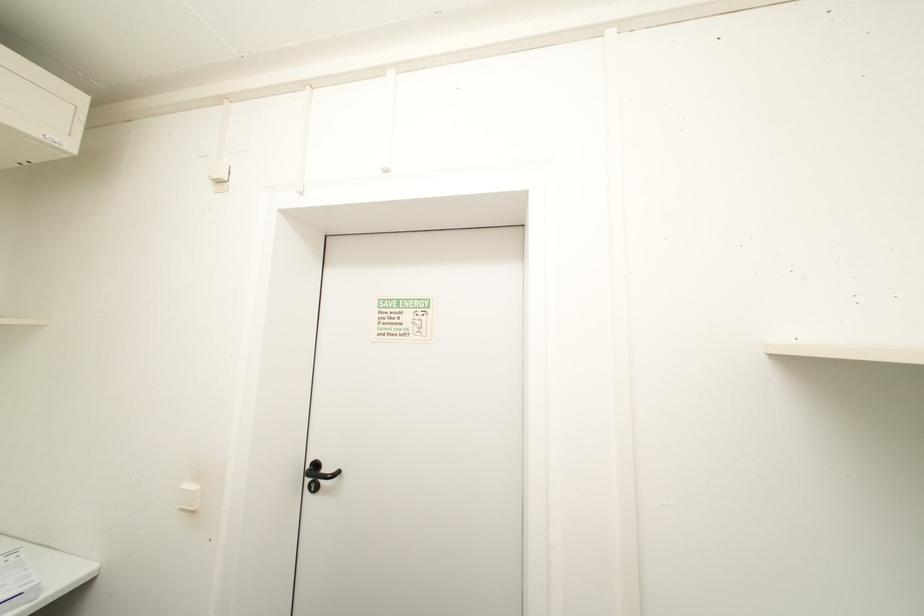
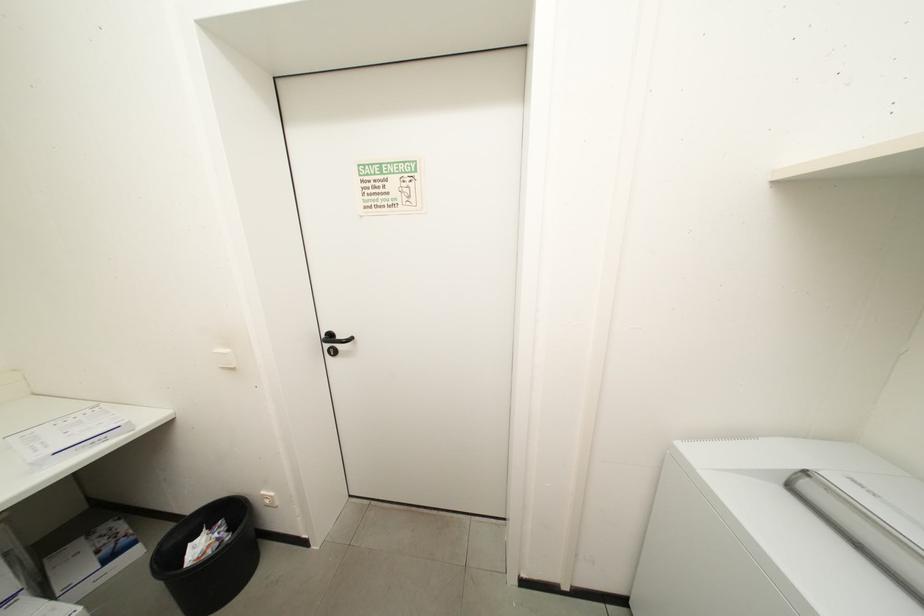
Which direction would the cameraman need to move to produce the second image?

The cameraman moved toward left, backward.